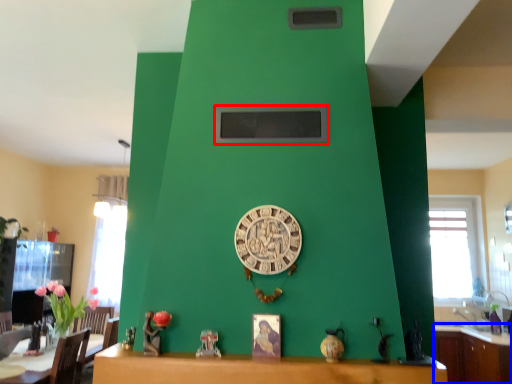
Question: Which object is further to the camera taking this photo, window screen (highlighted by a red box) or cabinetry (highlighted by a blue box)?

Choices:
 (A) window screen
 (B) cabinetry

Answer: (B)